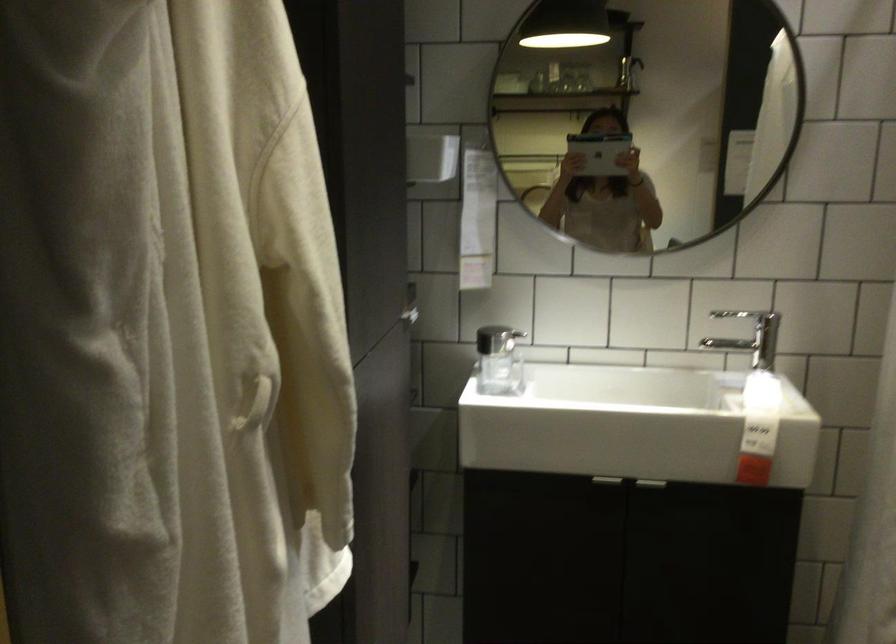
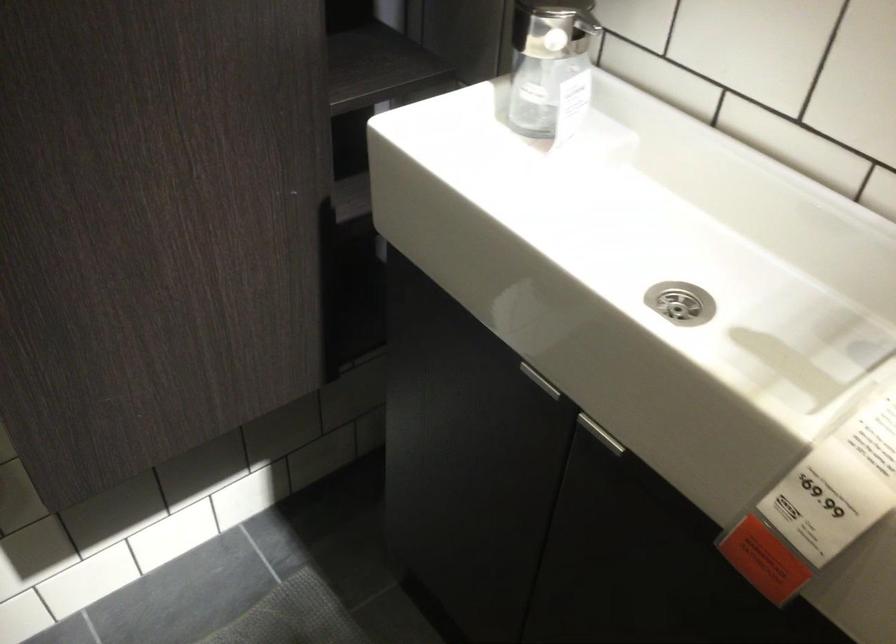
In the second image, find the point that corresponds to (x=615, y=484) in the first image.

(538, 381)